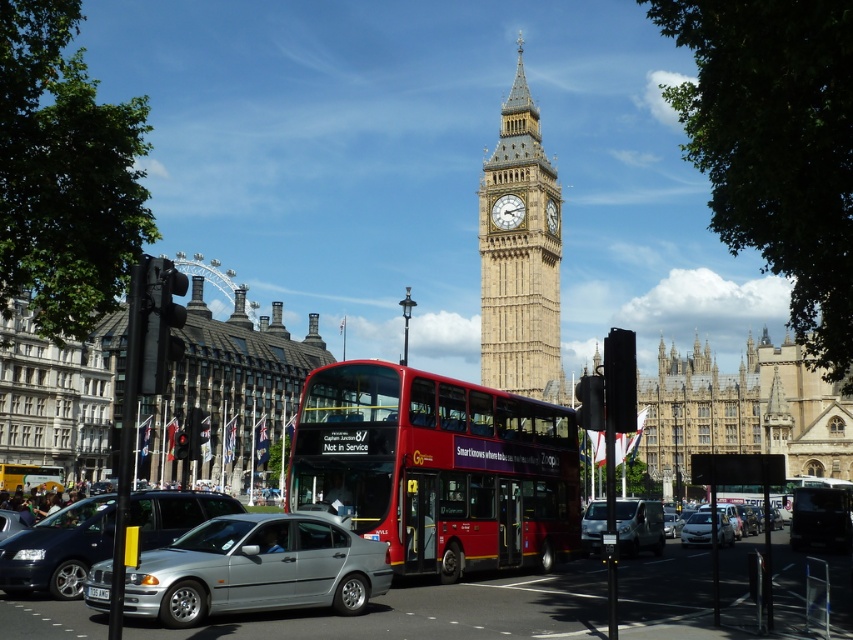
Based on the provided coordinates, can you identify the object located at point (x=706, y=529) in the image?

The object at point (x=706, y=529) is the silver metallic sedan at center.

You are a tour guide explaining the scene to visitors. You mention both the silver metallic car at lower left and the silver metallic sedan at lower left. Which one do you think is wider?

The silver metallic car at lower left might be wider than silver metallic sedan at lower left according to the description.

You are a tourist in London and want to take a photo of the silver metallic sedan at center without the white plastic license plate at center appearing in the shot. How can you adjust your camera angle to achieve this?

The silver metallic sedan at center is larger than the white plastic license plate at center. To avoid capturing the license plate, you can zoom in on the sedan or move closer to it so that the license plate becomes out of frame.